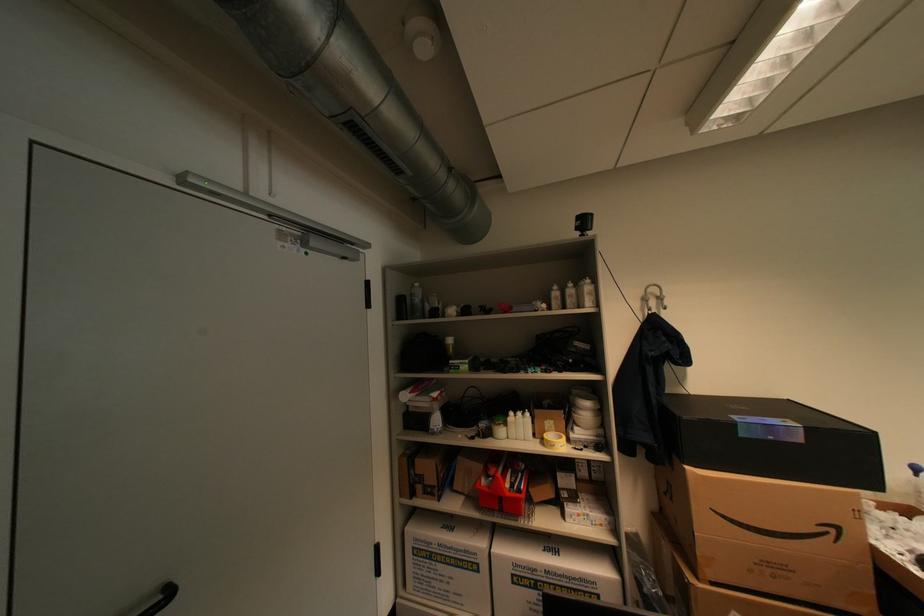
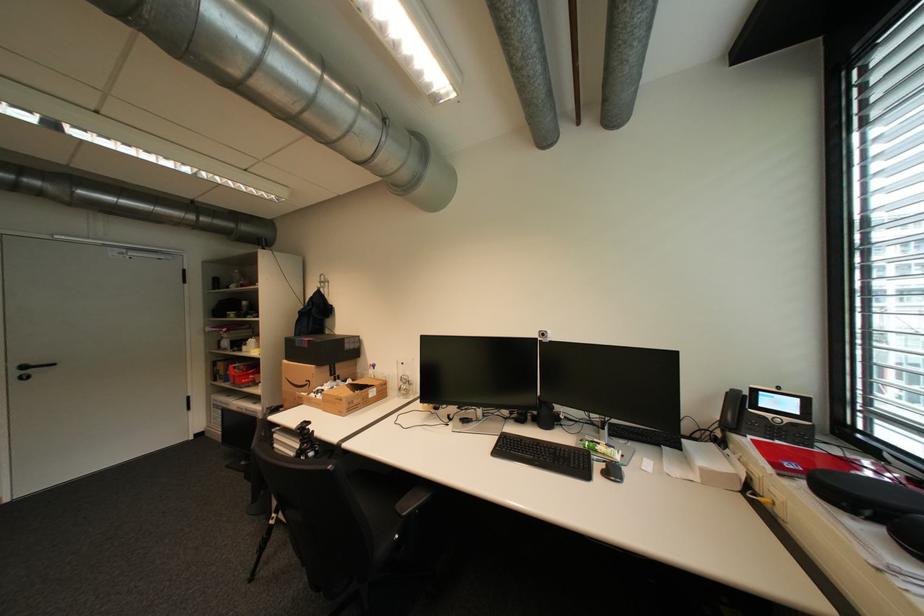
Question: Which direction would the cameraman need to move to produce the second image? Reply with the corresponding letter.

Choices:
 (A) Left
 (B) Right
 (C) Forward
 (D) Backward

Answer: (B)